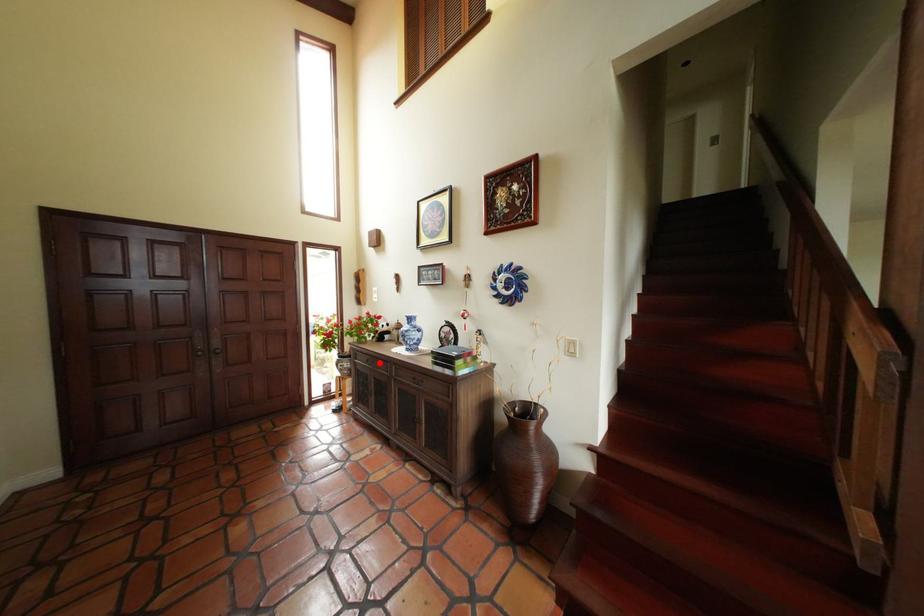
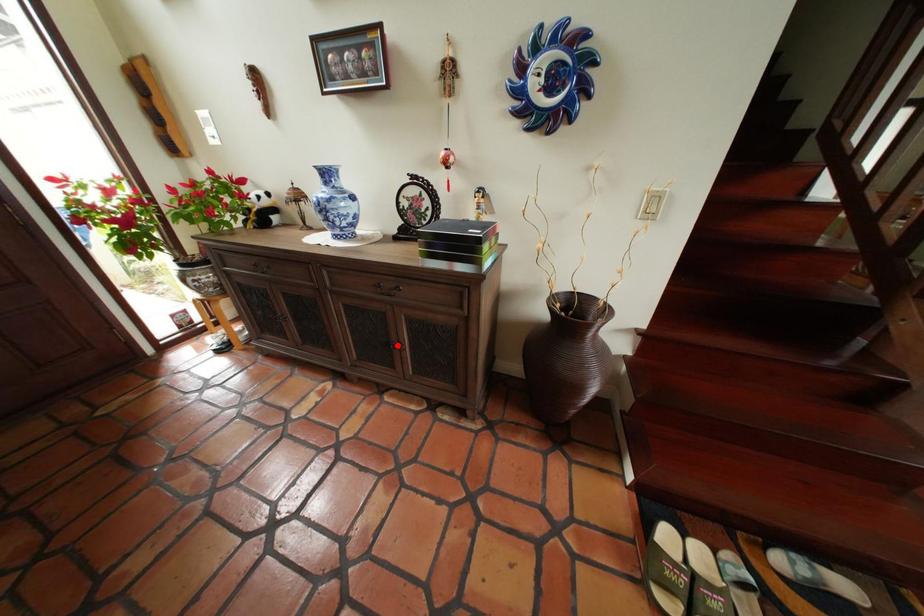
I am providing you with two images of the same scene from different viewpoints. A red point is marked on the first image and another point is marked on the second image. Do the highlighted points in image1 and image2 indicate the same real-world spot?

No